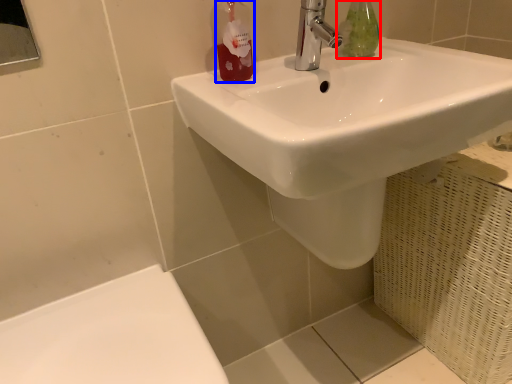
Question: Which of the following is the closest to the observer, mouthwash (highlighted by a red box) or toiletry (highlighted by a blue box)?

Choices:
 (A) mouthwash
 (B) toiletry

Answer: (B)